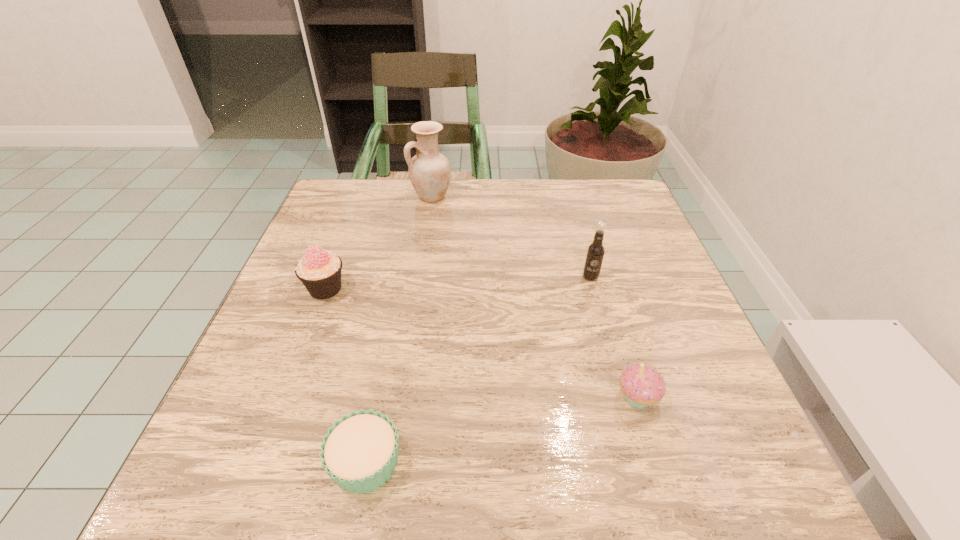
I want to click on vacant area situated 0.390m on the label of the root beer, so click(x=641, y=460).

Image resolution: width=960 pixels, height=540 pixels. Identify the location of free location located on the back of the leftmost cupcake. (359, 200).

Find the location of a particular element. Image resolution: width=960 pixels, height=540 pixels. vacant space located 0.190m on the back of the second farthest cupcake is located at coordinates (609, 301).

I want to click on free space located 0.240m on the back of the shortest object, so [x=395, y=316].

This screenshot has width=960, height=540. I want to click on object that is positioned at the far edge, so click(x=429, y=171).

Locate an element on the screen. This screenshot has width=960, height=540. object that is at the near edge is located at coordinates (360, 452).

At what (x,y) coordinates should I click in order to perform the action: click on object present at the left edge. Please return your answer as a coordinate pair (x, y). Looking at the image, I should click on (319, 270).

Find the location of a particular element. Image resolution: width=960 pixels, height=540 pixels. root beer positioned at the right edge is located at coordinates (595, 252).

Locate an element on the screen. The width and height of the screenshot is (960, 540). cupcake that is positioned at the right edge is located at coordinates (642, 385).

Identify the location of free space at the far edge of the desktop. This screenshot has width=960, height=540. (547, 206).